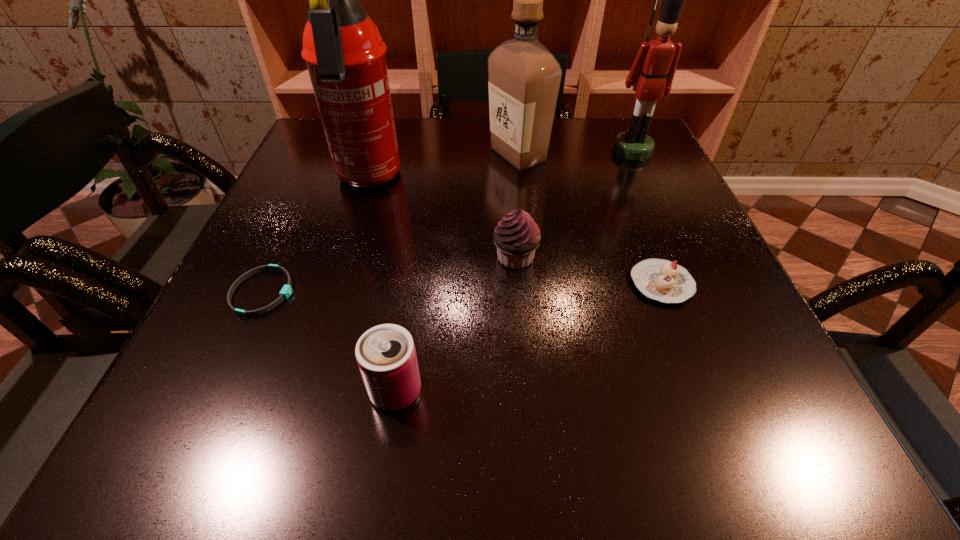
Find the location of a particular element. fire extinguisher is located at coordinates [x=345, y=55].

The height and width of the screenshot is (540, 960). What are the coordinates of `nutcracker` in the screenshot? It's located at (651, 75).

Where is `liquor`? The height and width of the screenshot is (540, 960). liquor is located at coordinates (524, 77).

The image size is (960, 540). I want to click on the taller cupcake, so click(517, 236).

Where is `can`? This screenshot has width=960, height=540. can is located at coordinates (386, 356).

Locate an element on the screen. The image size is (960, 540). the fifth object from right to left is located at coordinates (386, 356).

I want to click on the right cupcake, so pos(662,280).

Where is `the shorter cupcake`? The width and height of the screenshot is (960, 540). the shorter cupcake is located at coordinates (662, 280).

This screenshot has width=960, height=540. Identify the location of wristband. (286, 291).

The height and width of the screenshot is (540, 960). I want to click on free spot located on the trigger side of the fire extinguisher, so tap(346, 251).